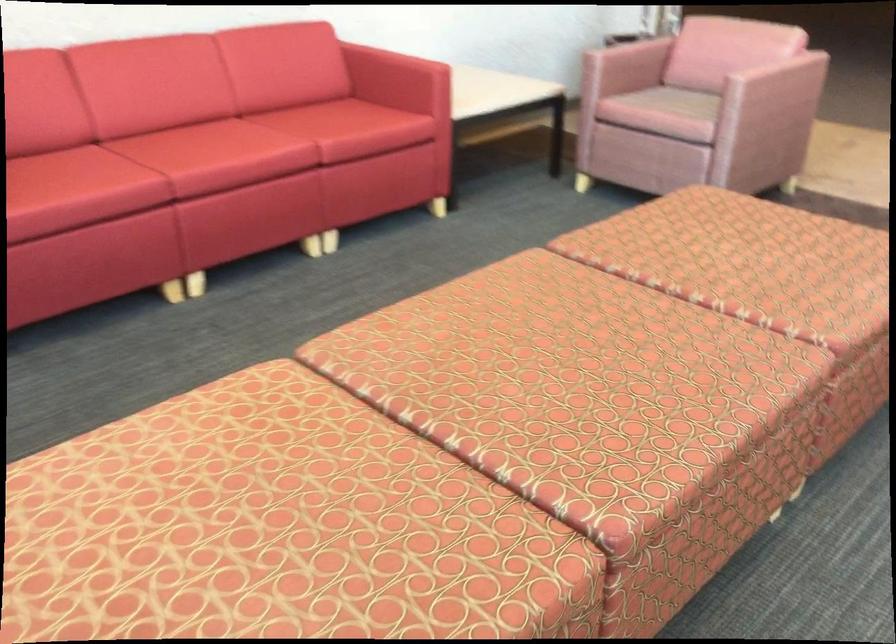
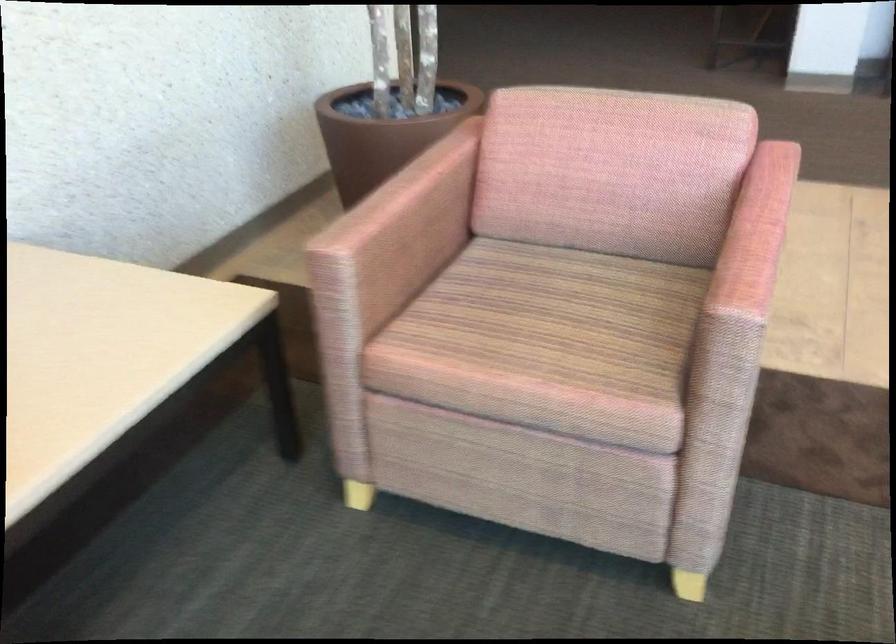
Question: Which direction would the cameraman need to move to produce the second image? Reply with the corresponding letter.

Choices:
 (A) Left
 (B) Right
 (C) Forward
 (D) Backward

Answer: (C)